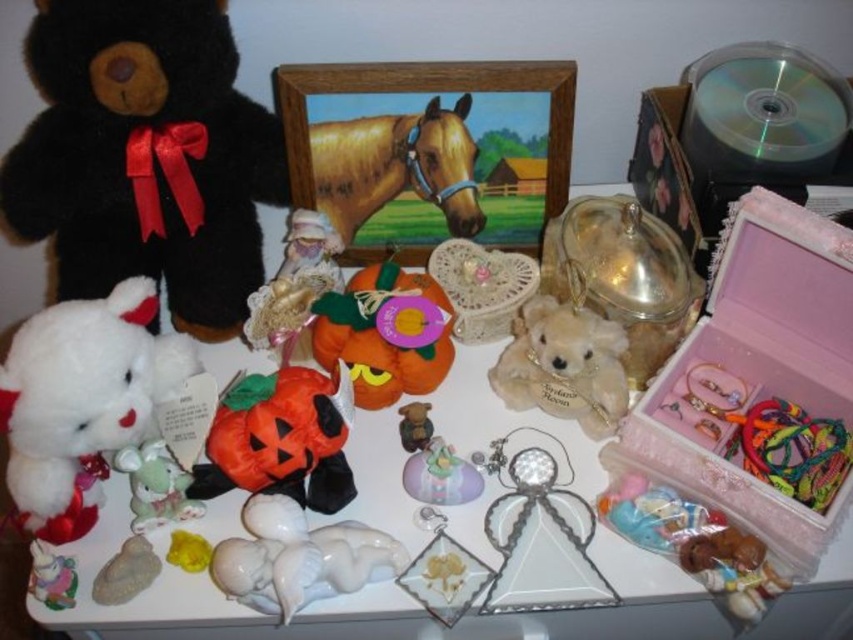
You are standing in front of the white surface where the items are arranged. You see two points marked as point (376, 294) and point (524, 360). Which point is closer to you?

Point (376, 294) is in front of point (524, 360), so it is closer to you.

You are organizing a Halloween display and need to place the orange fabric pumpkin at center and the matte gold bear at center in a specific arrangement. According to the image, which object is positioned to the left of the other?

The orange fabric pumpkin at center is to the left of the matte gold bear at center.